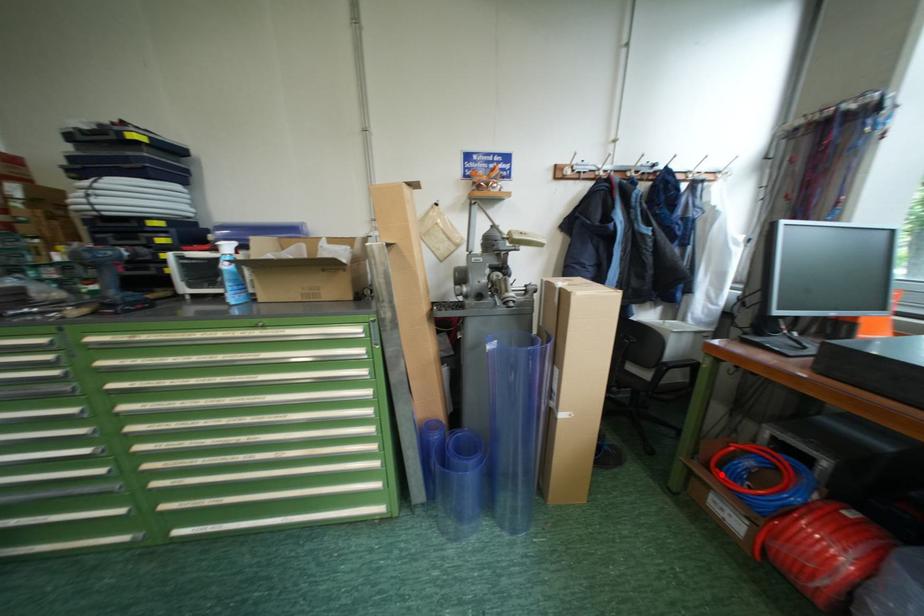
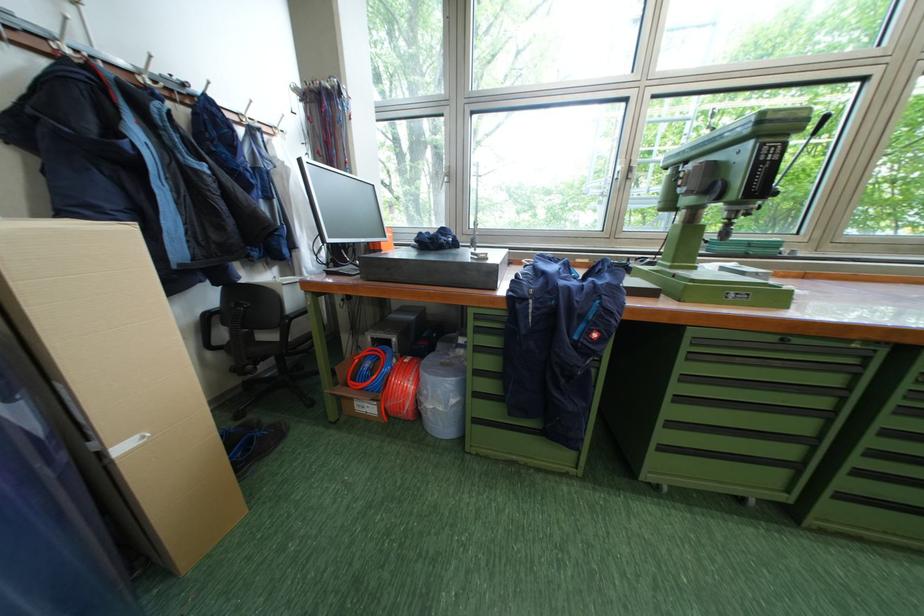
Question: I am providing you with two images of the same scene from different viewpoints. Given a red point in image1, look at the same physical point in image2. Is it:

Choices:
 (A) Closer to the viewpoint
 (B) Farther from the viewpoint

Answer: (B)